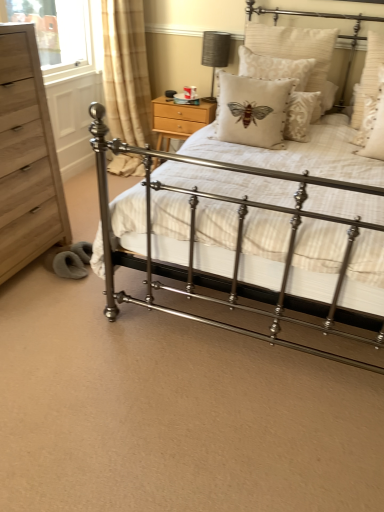
Question: Is white textured pillow with moth design at center, marked as the fifth pillow in a right-to-left arrangement, to the left or to the right of white textured pillow at upper right, which is the fifth pillow in left-to-right order, in the image?

Choices:
 (A) left
 (B) right

Answer: (A)

Question: Relative to white textured pillow at upper right, which ranks as the 1th pillow in right-to-left order, is white textured pillow with moth design at center, which appears as the first pillow when viewed from the left, in front or behind?

Choices:
 (A) behind
 (B) front

Answer: (B)

Question: Estimate the real-world distances between objects in this image. Which object is farther from the white textured pillow at upper right, which is counted as the fourth pillow, starting from the left?

Choices:
 (A) light brown wood chest of drawers at left
 (B) beige textured pillow with bee design at center, arranged as the third pillow when viewed from the right
 (C) beige plaid curtain at upper left
 (D) metallic iron bed at center
 (E) wooden nightstand at upper center

Answer: (C)

Question: Which is nearer to the beige textured pillow with bee design at center, which appears as the 3th pillow when viewed from the left?

Choices:
 (A) beige textured pillow at upper right, the fourth pillow in the right-to-left sequence
 (B) white textured pillow with moth design at center, which appears as the first pillow when viewed from the left
 (C) light brown wood chest of drawers at left
 (D) beige plaid curtain at upper left
 (E) white textured pillow at upper right, which ranks as the 1th pillow in right-to-left order

Answer: (A)